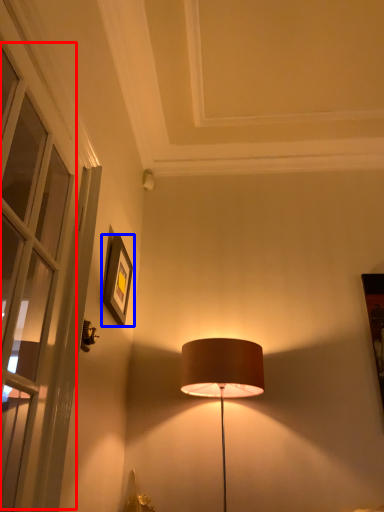
Question: Which of the following is the farthest to the observer, window (highlighted by a red box) or picture frame (highlighted by a blue box)?

Choices:
 (A) window
 (B) picture frame

Answer: (B)